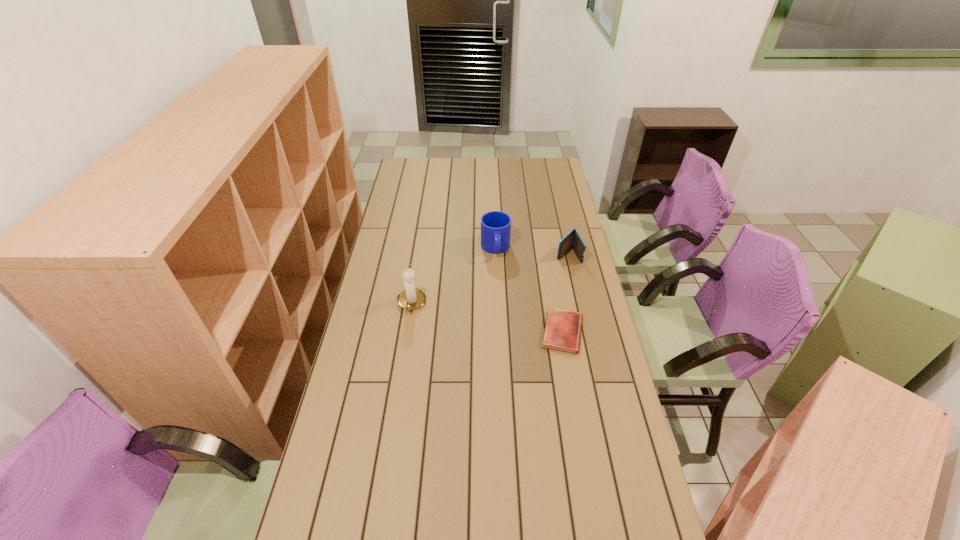
This screenshot has width=960, height=540. I want to click on the leftmost object, so (x=411, y=298).

This screenshot has height=540, width=960. What are the coordinates of `the tallest object` in the screenshot? It's located at (411, 298).

Locate an element on the screen. Image resolution: width=960 pixels, height=540 pixels. diary is located at coordinates (562, 332).

The height and width of the screenshot is (540, 960). What are the coordinates of `mug` in the screenshot? It's located at (495, 226).

Image resolution: width=960 pixels, height=540 pixels. In order to click on the second object from left to right in this screenshot , I will do `click(495, 226)`.

The width and height of the screenshot is (960, 540). In order to click on the third tallest object in this screenshot , I will do `click(573, 239)`.

Image resolution: width=960 pixels, height=540 pixels. Identify the location of blank space located 0.390m on the handle side of the candle holder. (395, 411).

Identify the location of free space located on the back of the shortest object. The height and width of the screenshot is (540, 960). (549, 254).

The height and width of the screenshot is (540, 960). Find the location of `vacant space positioned 0.170m on the side with the handle of the mug`. vacant space positioned 0.170m on the side with the handle of the mug is located at coordinates (500, 291).

You are a GUI agent. You are given a task and a screenshot of the screen. Output one action in this format:
    pyautogui.click(x=<x>, y=<y>)
    Task: Click on the free spot located on the side with the handle of the mug
    The image size is (960, 540).
    Given the screenshot: What is the action you would take?
    pyautogui.click(x=502, y=305)